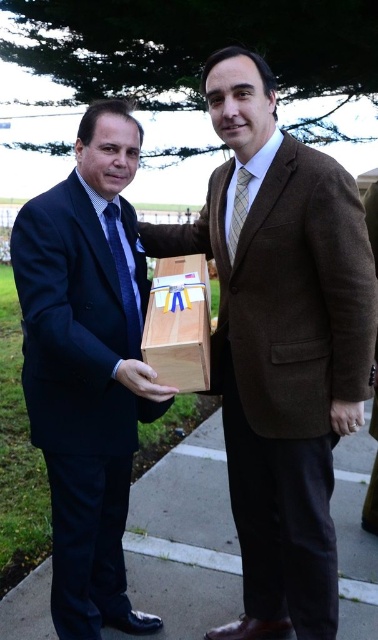
Question: Which object is closer to the camera taking this photo?

Choices:
 (A) smooth concrete pavement at lower center
 (B) matte wood box at center
 (C) matte brown wooden box at center

Answer: (B)

Question: Does natural wood box at center have a greater width compared to blue textured tie at left?

Choices:
 (A) no
 (B) yes

Answer: (B)

Question: Is brown woolen suit at center thinner than matte brown wooden box at center?

Choices:
 (A) no
 (B) yes

Answer: (A)

Question: Is matte wood box at center wider than blue textured tie at left?

Choices:
 (A) yes
 (B) no

Answer: (A)

Question: Which object is positioned closest to the blue textured tie at left?

Choices:
 (A) smooth concrete pavement at lower center
 (B) plaid wool tie at center
 (C) matte brown wooden box at center
 (D) matte wood box at center

Answer: (D)

Question: Among these points, which one is farthest from the camera?

Choices:
 (A) (116, 250)
 (B) (240, 211)

Answer: (A)